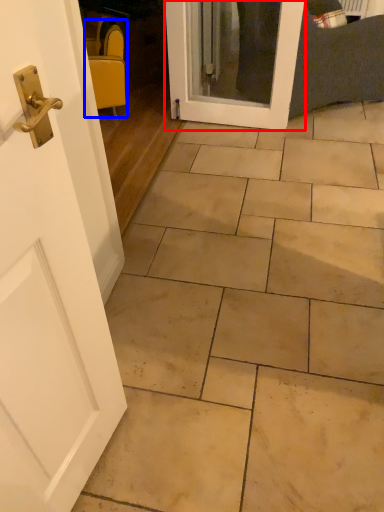
Question: Among these objects, which one is farthest to the camera, door (highlighted by a red box) or chair (highlighted by a blue box)?

Choices:
 (A) door
 (B) chair

Answer: (B)